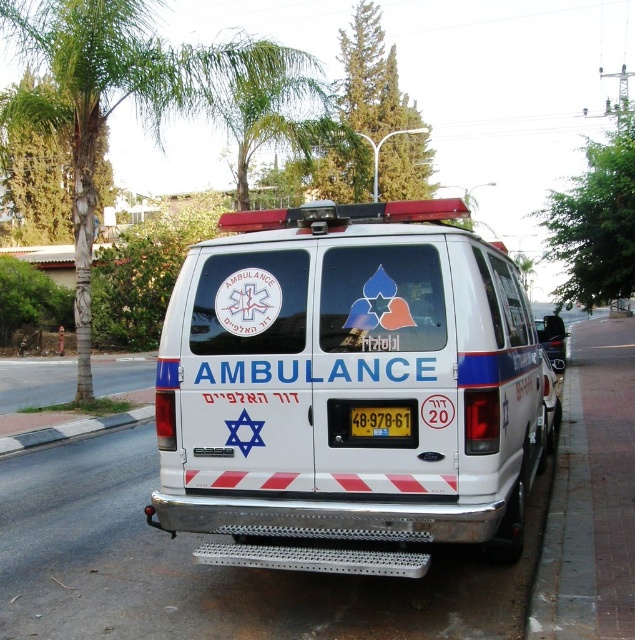
Who is positioned more to the right, yellow metallic license plate at center or glossy black mirror at right?

Positioned to the right is glossy black mirror at right.

Is the position of yellow metallic license plate at center more distant than that of glossy black mirror at right?

No, yellow metallic license plate at center is closer to the viewer.

Between point (352, 406) and point (552, 317), which one is positioned in front?

Point (352, 406) is more forward.

You are a GUI agent. You are given a task and a screenshot of the screen. Output one action in this format:
    pyautogui.click(x=<x>, y=<y>)
    Task: Click on the yellow metallic license plate at center
    This screenshot has width=635, height=640.
    Given the screenshot: What is the action you would take?
    pyautogui.click(x=381, y=420)

Can you confirm if white glossy ambulance at center is thinner than glossy black mirror at right?

Indeed, white glossy ambulance at center has a lesser width compared to glossy black mirror at right.

Locate an element on the screen. Image resolution: width=635 pixels, height=640 pixels. white glossy ambulance at center is located at coordinates (345, 388).

Does point (272, 476) come farther from viewer compared to point (358, 406)?

Yes, point (272, 476) is behind point (358, 406).

Measure the distance between point (384, 563) and camera.

Point (384, 563) is 3.89 meters from camera.

Between point (265, 324) and point (394, 408), which one is positioned behind?

Positioned behind is point (265, 324).

Identify the location of white glossy ambulance at center. The width and height of the screenshot is (635, 640). (345, 388).